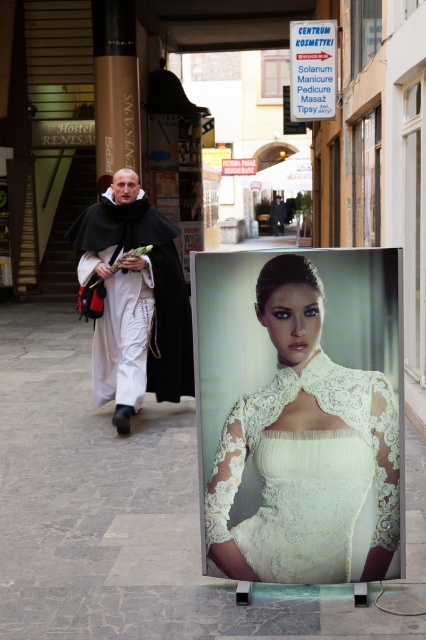
The image size is (426, 640). Describe the element at coordinates (305, 451) in the screenshot. I see `white lace dress at center` at that location.

Does point (394, 428) come farther from viewer compared to point (138, 298)?

No, (394, 428) is in front of (138, 298).

Which is in front, point (291, 573) or point (117, 419)?

Point (291, 573)

Find the location of `white lace dress at center`. white lace dress at center is located at coordinates (305, 451).

Describe the element at coordinates (123, 515) in the screenshot. This screenshot has width=426, height=640. I see `gray stone pavement at center` at that location.

This screenshot has height=640, width=426. What do you see at coordinates (123, 515) in the screenshot?
I see `gray stone pavement at center` at bounding box center [123, 515].

What are the coordinates of `gray stone pavement at center` in the screenshot? It's located at (123, 515).

Between white woolen robe at center and white lace billboard at center, which one is positioned lower?

white woolen robe at center

Is white woolen robe at center to the left of white lace billboard at center from the viewer's perspective?

Correct, you'll find white woolen robe at center to the left of white lace billboard at center.

Find the location of `white woolen robe at center`. white woolen robe at center is located at coordinates (135, 300).